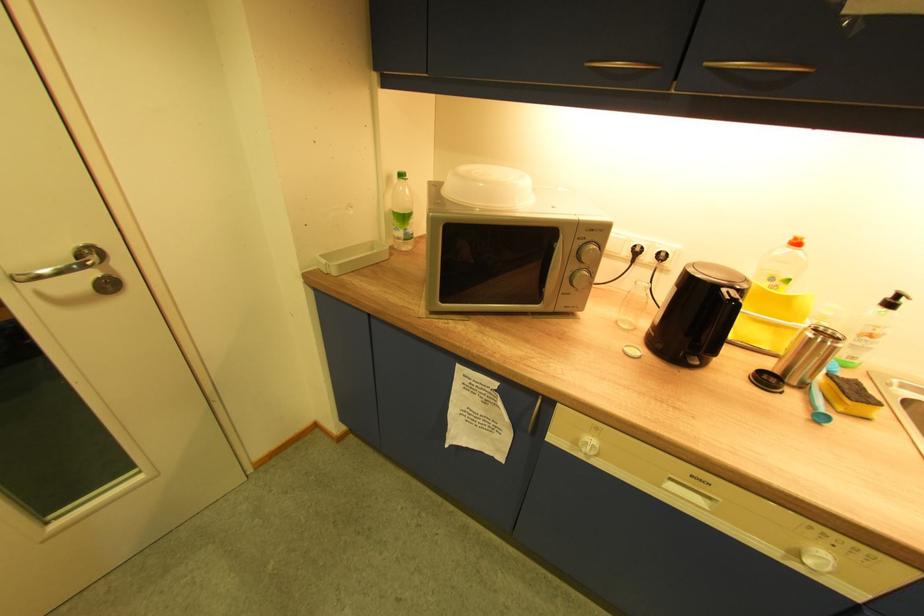
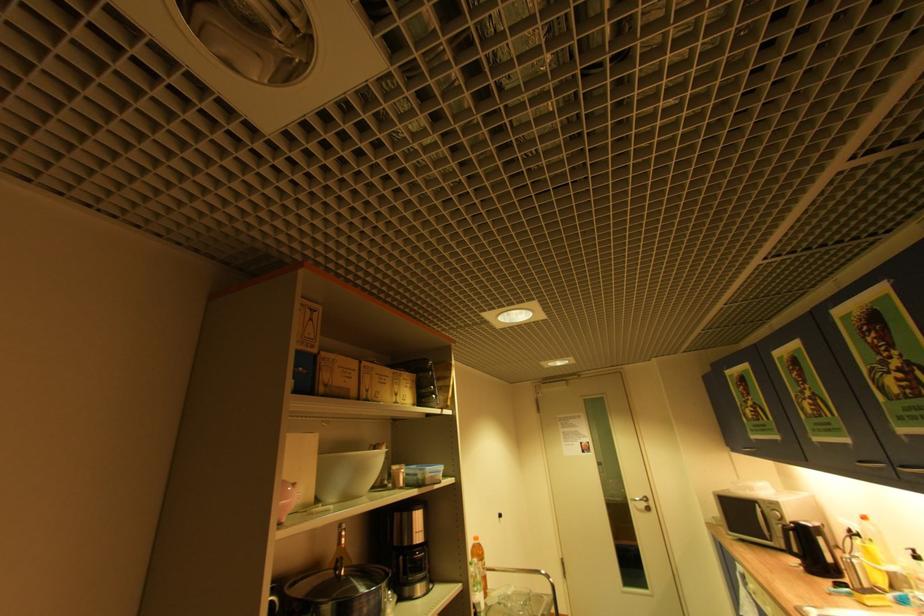
Locate, in the second image, the point that corresponds to point 98,275 in the first image.

(650, 505)